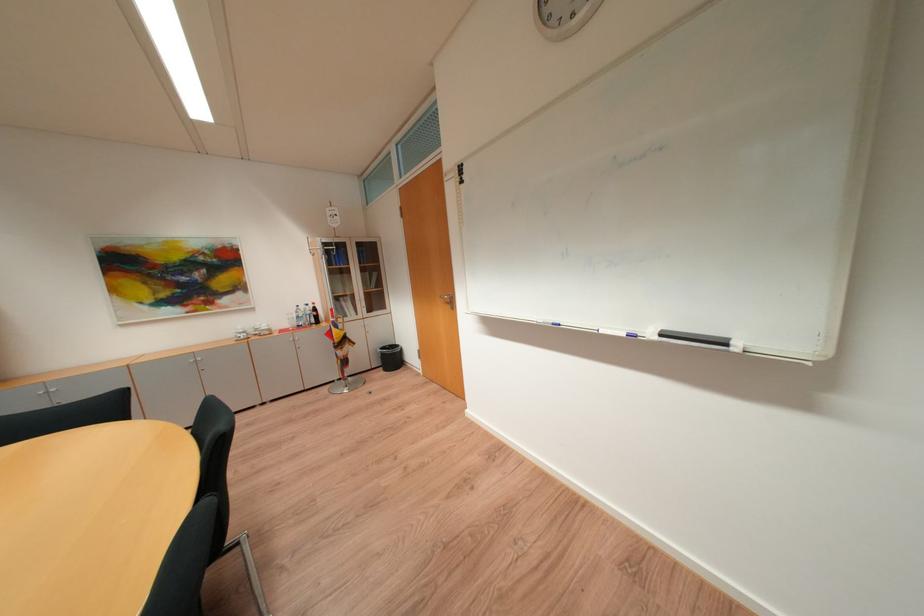
Identify the location of silver door handle. (447, 300).